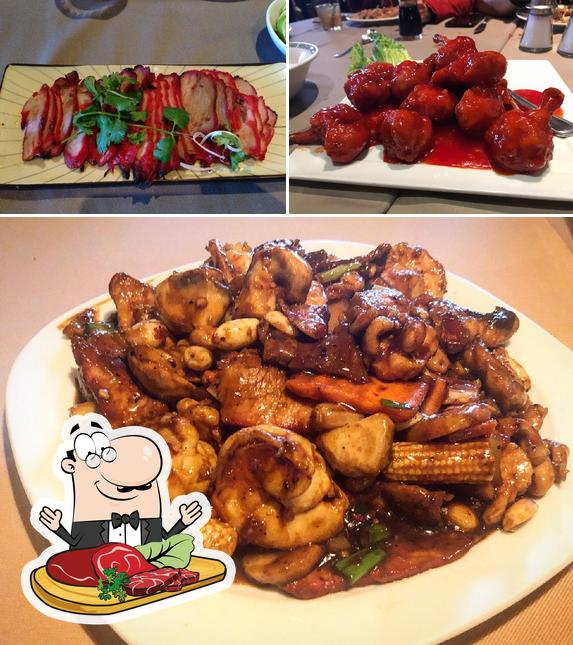
You are a GUI agent. You are given a task and a screenshot of the screen. Output one action in this format:
    pyautogui.click(x=<x>, y=<y>)
    Task: Click on the utensil
    The image size is (573, 645).
    Given the screenshot: What is the action you would take?
    pyautogui.click(x=523, y=103)